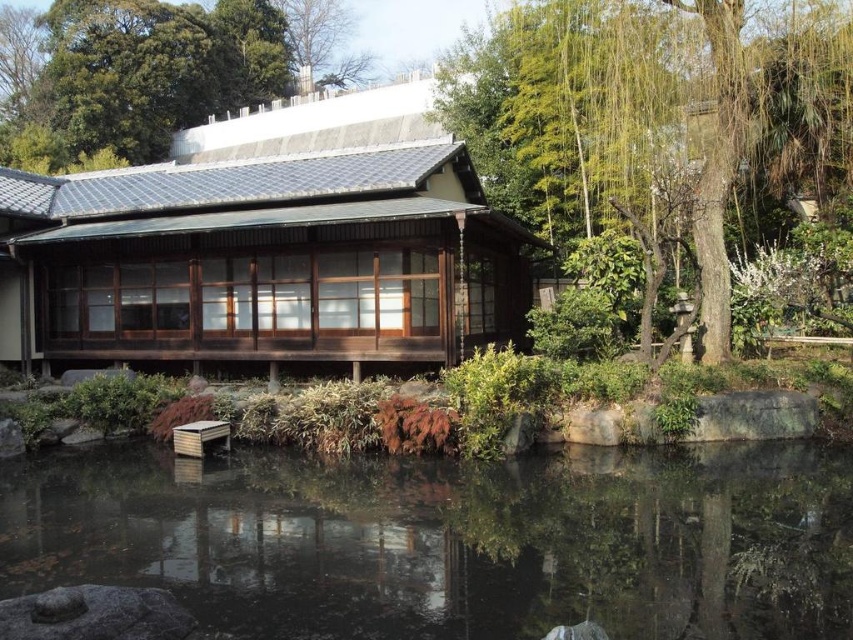
Is transparent water at pond center further to camera compared to green leafy tree at upper center?

No, it is not.

Is point (421, 616) farther from camera compared to point (126, 118)?

No, (421, 616) is closer to viewer.

Locate an element on the screen. transparent water at pond center is located at coordinates (450, 540).

This screenshot has width=853, height=640. What are the coordinates of `transparent water at pond center` in the screenshot? It's located at (450, 540).

Is point (647, 518) less distant than point (709, 260)?

Yes, it is.

Can you confirm if transparent water at pond center is bigger than green leafy tree at right?

Actually, transparent water at pond center might be smaller than green leafy tree at right.

Describe the element at coordinates (450, 540) in the screenshot. I see `transparent water at pond center` at that location.

The height and width of the screenshot is (640, 853). Identify the location of transparent water at pond center. (450, 540).

Is point (663, 93) farther from viewer compared to point (71, 116)?

No, (663, 93) is closer to viewer.

Is green leafy tree at right above green leafy tree at upper center?

Actually, green leafy tree at right is below green leafy tree at upper center.

Which is behind, point (778, 100) or point (166, 17)?

Positioned behind is point (166, 17).

Find the location of `green leafy tree at right`. green leafy tree at right is located at coordinates (647, 113).